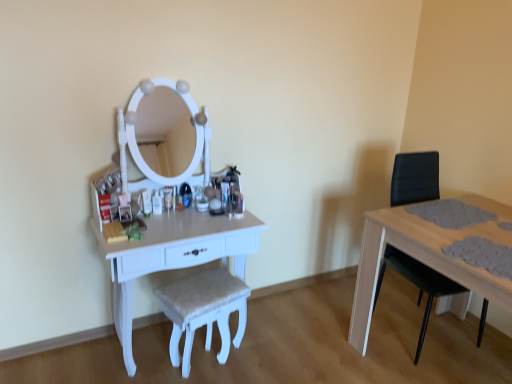
Question: Is white glossy table at left at the back of white textured stool at center?

Choices:
 (A) yes
 (B) no

Answer: (A)

Question: From the image's perspective, is white textured stool at center below white glossy table at left?

Choices:
 (A) no
 (B) yes

Answer: (B)

Question: Does white textured stool at center have a lesser height compared to white glossy table at left?

Choices:
 (A) yes
 (B) no

Answer: (A)

Question: Is white textured stool at center beside white glossy table at left?

Choices:
 (A) yes
 (B) no

Answer: (B)

Question: Is white textured stool at center positioned in front of white glossy table at left?

Choices:
 (A) yes
 (B) no

Answer: (B)

Question: In terms of width, does black leather swivel chair at right look wider or thinner when compared to white glossy table at left?

Choices:
 (A) thin
 (B) wide

Answer: (B)

Question: From a real-world perspective, is black leather swivel chair at right physically located above or below white glossy table at left?

Choices:
 (A) above
 (B) below

Answer: (A)

Question: Considering their positions, is black leather swivel chair at right located in front of or behind white glossy table at left?

Choices:
 (A) front
 (B) behind

Answer: (B)

Question: Is black leather swivel chair at right situated inside white glossy table at left or outside?

Choices:
 (A) outside
 (B) inside

Answer: (A)

Question: Which is correct: white glossy table at left is inside black leather swivel chair at right, or outside of it?

Choices:
 (A) outside
 (B) inside

Answer: (A)

Question: In terms of height, does white glossy table at left look taller or shorter compared to black leather swivel chair at right?

Choices:
 (A) short
 (B) tall

Answer: (A)

Question: Would you say white glossy table at left is to the left or to the right of black leather swivel chair at right in the picture?

Choices:
 (A) right
 (B) left

Answer: (B)

Question: Is white glossy table at left wider or thinner than black leather swivel chair at right?

Choices:
 (A) wide
 (B) thin

Answer: (B)

Question: Does point (221, 283) appear closer or farther from the camera than point (413, 183)?

Choices:
 (A) closer
 (B) farther

Answer: (A)

Question: Relative to black leather swivel chair at right, is white textured stool at center in front or behind?

Choices:
 (A) behind
 (B) front

Answer: (B)